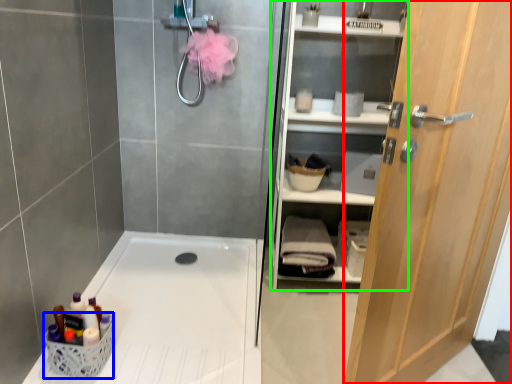
Question: Which object is the closest to the door (highlighted by a red box)? Choose among these: basket (highlighted by a blue box) or shelf (highlighted by a green box).

Choices:
 (A) basket
 (B) shelf

Answer: (B)